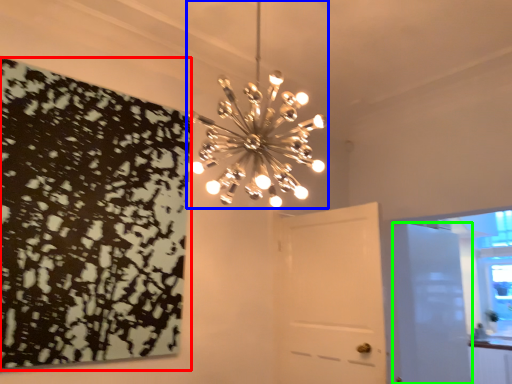
Question: Based on their relative distances, which object is farther from print (highlighted by a red box)? Choose from lamp (highlighted by a blue box) and door (highlighted by a green box).

Choices:
 (A) lamp
 (B) door

Answer: (B)